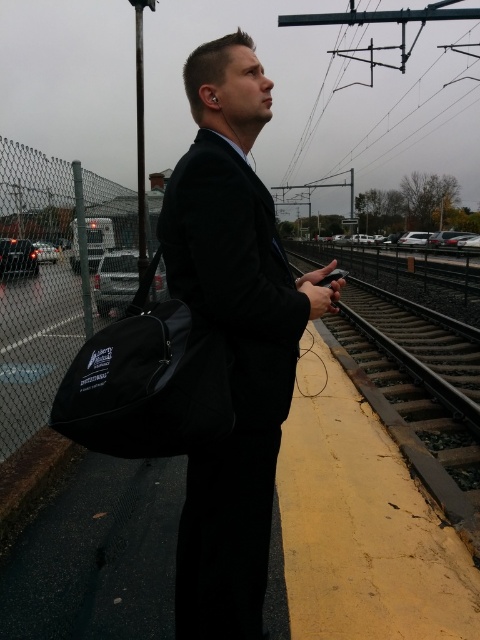
Is black fabric bag at left smaller than metal train track at center?

Indeed, black fabric bag at left has a smaller size compared to metal train track at center.

Who is shorter, black fabric bag at left or metal train track at center?

black fabric bag at left is shorter.

Measure the distance between black fabric bag at left and camera.

black fabric bag at left and camera are 3.75 feet apart.

Locate an element on the screen. The height and width of the screenshot is (640, 480). black fabric bag at left is located at coordinates (147, 381).

Is matte black suit at center below black fabric bag at left?

No, matte black suit at center is not below black fabric bag at left.

Is point (194, 220) positioned before point (158, 352)?

Yes, point (194, 220) is closer to viewer.

I want to click on matte black suit at center, so click(x=232, y=337).

The width and height of the screenshot is (480, 640). Find the location of `matte black suit at center`. matte black suit at center is located at coordinates (232, 337).

Is matte black suit at center thinner than metal train track at center?

Yes, matte black suit at center is thinner than metal train track at center.

Between point (217, 564) and point (414, 388), which one is positioned behind?

The point (414, 388) is more distant.

Find the location of a particular element. The width and height of the screenshot is (480, 640). matte black suit at center is located at coordinates 232,337.